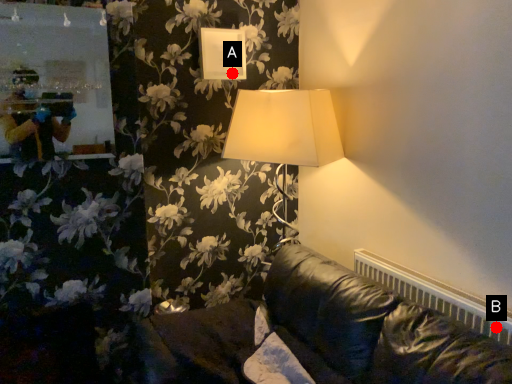
Question: Two points are circled on the image, labeled by A and B beside each circle. Which of the following is the closest to the observer?

Choices:
 (A) A is closer
 (B) B is closer

Answer: (B)